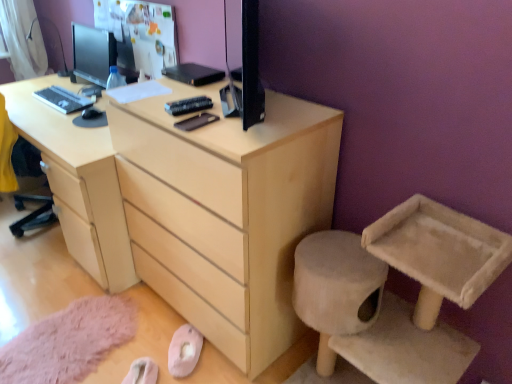
Identify the location of free spot in front of matte black monitor at upper left. (56, 107).